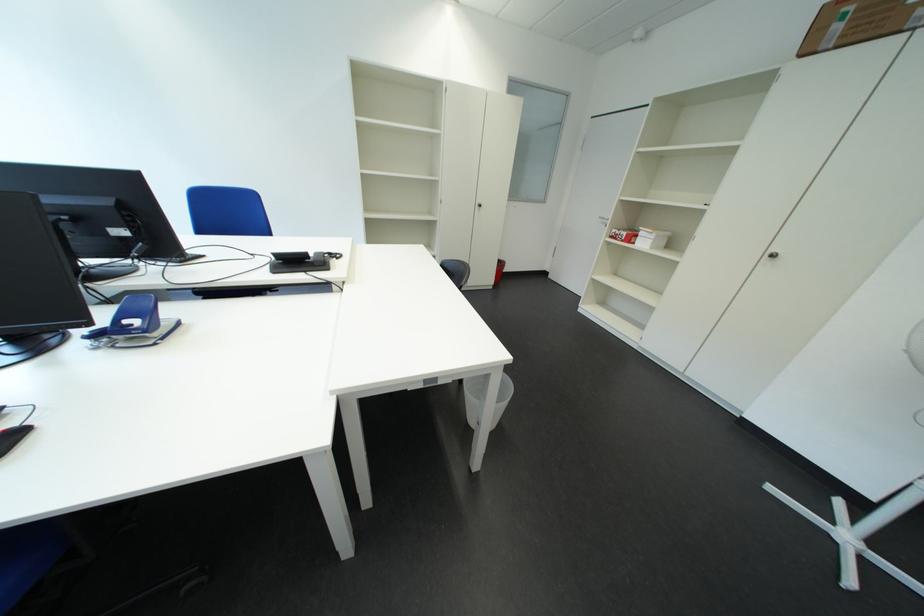
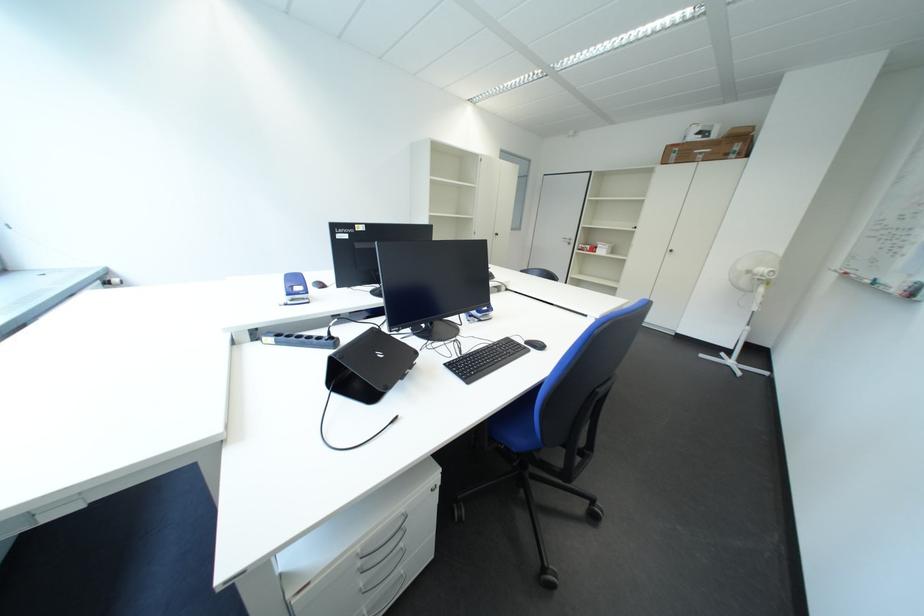
Question: Which direction would the cameraman need to move to produce the second image? Reply with the corresponding letter.

Choices:
 (A) Left
 (B) Right
 (C) Forward
 (D) Backward

Answer: (A)